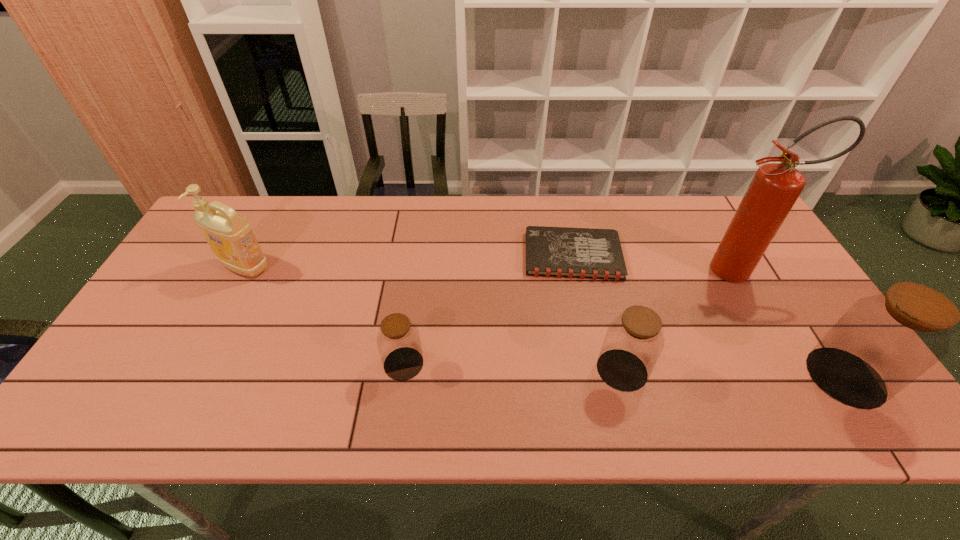
Image resolution: width=960 pixels, height=540 pixels. Identify the location of free space that satisfies the following two spatial constraints: 1. from the nozzle of the fire extinguisher; 2. on the left side of the tallest jar. (800, 377).

Image resolution: width=960 pixels, height=540 pixels. I want to click on free space that satisfies the following two spatial constraints: 1. from the nozzle of the tallest object; 2. on the left side of the tallest jar, so click(x=800, y=377).

I want to click on free space in the image that satisfies the following two spatial constraints: 1. on the back side of the shortest object; 2. on the left side of the detergent, so click(x=252, y=255).